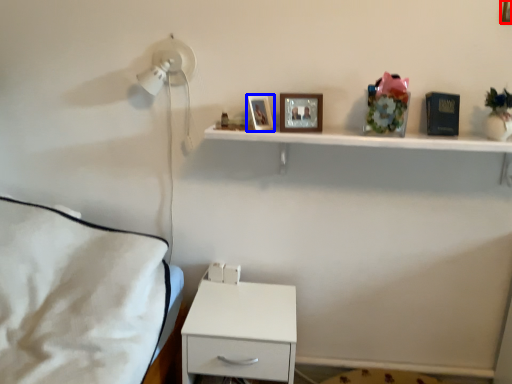
Question: Which of the following is the farthest to the observer, picture frame (highlighted by a red box) or picture frame (highlighted by a blue box)?

Choices:
 (A) picture frame
 (B) picture frame

Answer: (B)